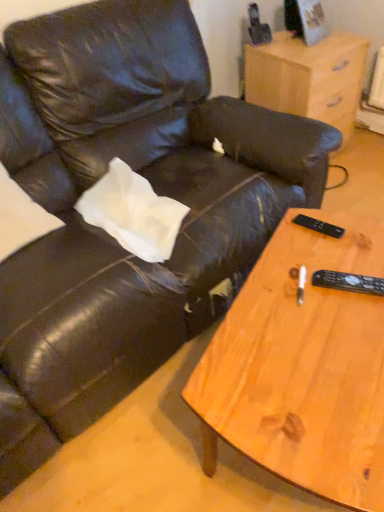
This screenshot has width=384, height=512. I want to click on vacant region to the right of black plastic remote at right, which ranks as the 1th remote in top-to-bottom order, so click(358, 228).